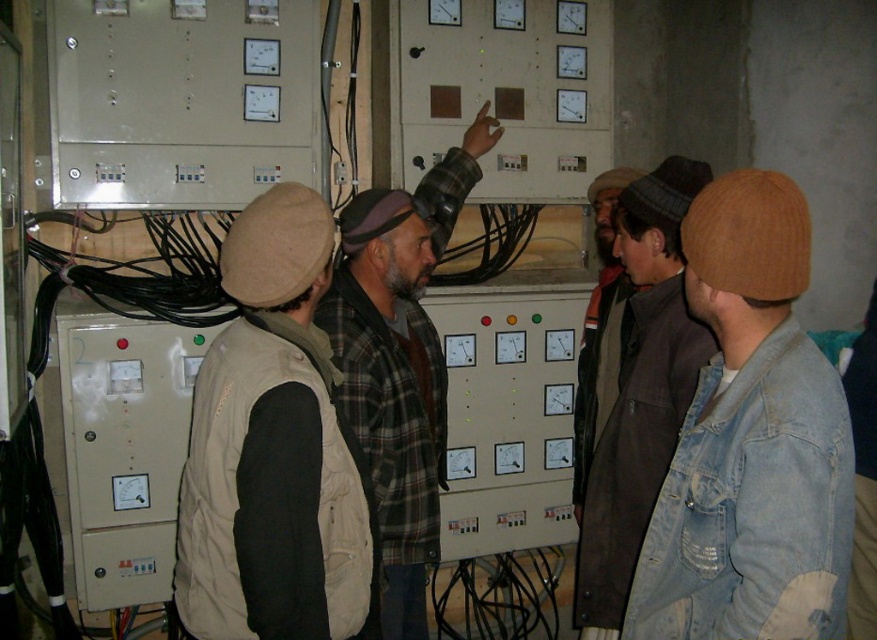
Question: Which object is the farthest from the faded denim jacket at lower right?

Choices:
 (A) plaid flannel shirt at center
 (B) brown woolen hat at center
 (C) denim jacket at center
 (D) beige fabric vest at center

Answer: (B)

Question: From the image, what is the correct spatial relationship of faded denim jacket at lower right in relation to brown woolen hat at center?

Choices:
 (A) below
 (B) above

Answer: (A)

Question: Which point is farther to the camera?

Choices:
 (A) (241, 253)
 (B) (806, 525)
 (C) (593, 285)

Answer: (C)

Question: Considering the relative positions of plaid flannel shirt at center and denim jacket at center in the image provided, where is plaid flannel shirt at center located with respect to denim jacket at center?

Choices:
 (A) above
 (B) below

Answer: (B)

Question: Is plaid flannel shirt at center below brown woolen hat at center?

Choices:
 (A) no
 (B) yes

Answer: (B)

Question: Which point is farther to the camera?

Choices:
 (A) faded denim jacket at lower right
 (B) brown woolen hat at center
 (C) plaid flannel shirt at center

Answer: (B)